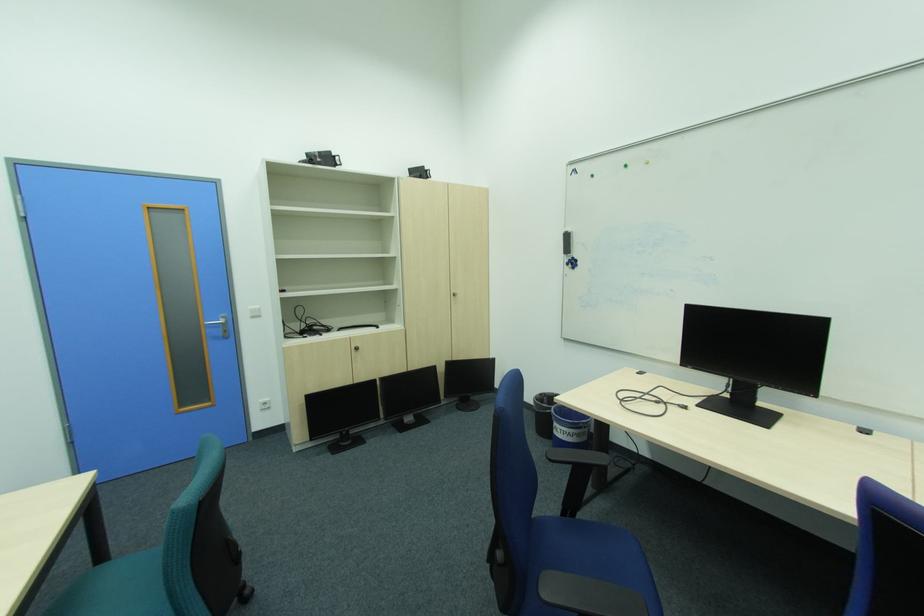
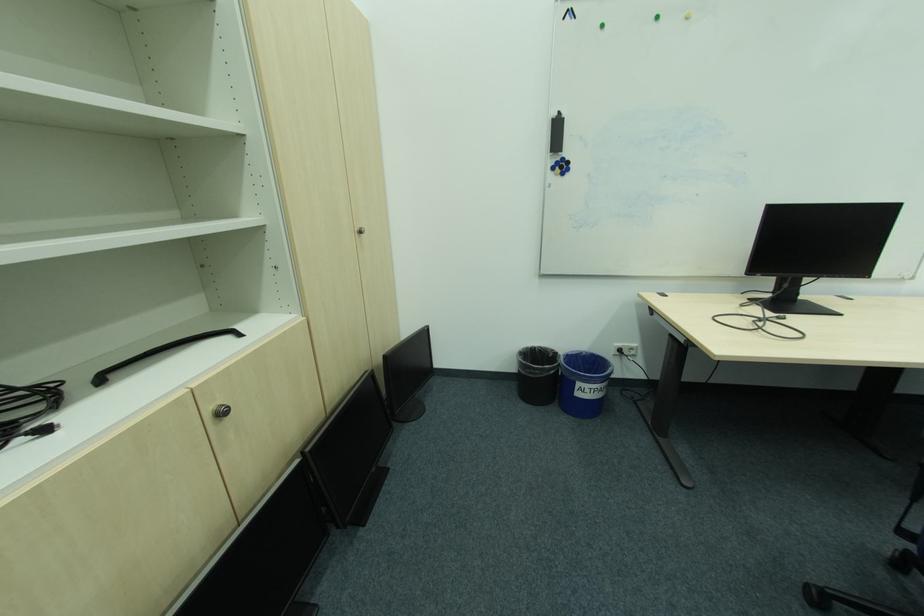
Locate, in the second image, the point that corresponds to pixel 572 254 in the first image.

(558, 152)